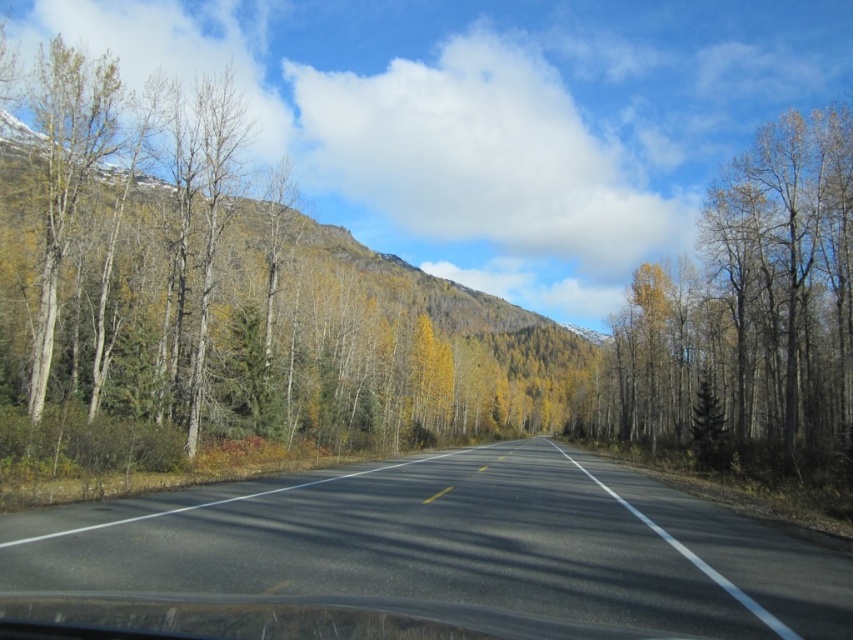
Based on the photo, you are driving along the two lane road and want to determine the distance between two points on the road. The first point is at coordinates point (636,556) and the second is at point (769,180). Which point is closer to your current position?

Point (636,556) is closer to the viewer than point (769,180).